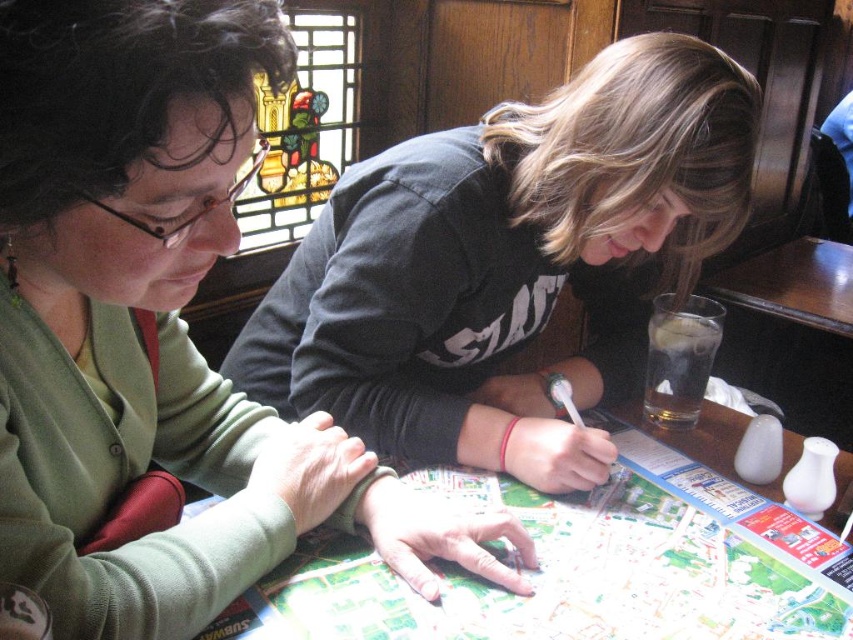
Can you confirm if green matte sweater at upper left is positioned to the right of white paper map at center?

Incorrect, green matte sweater at upper left is not on the right side of white paper map at center.

Is point (178, 616) positioned in front of point (573, 628)?

That is True.

The height and width of the screenshot is (640, 853). Identify the location of green matte sweater at upper left. (157, 333).

Is matte black shirt at center shorter than wooden table at right?

In fact, matte black shirt at center may be taller than wooden table at right.

Does point (663, 76) come behind point (834, 282)?

That is False.

At what (x,y) coordinates should I click in order to perform the action: click on matte black shirt at center. Please return your answer as a coordinate pair (x, y). This screenshot has height=640, width=853. Looking at the image, I should click on (508, 262).

Which is behind, point (253, 348) or point (650, 586)?

Positioned behind is point (253, 348).

Does matte black shirt at center have a smaller size compared to white paper map at center?

Actually, matte black shirt at center might be larger than white paper map at center.

What are the coordinates of `matte black shirt at center` in the screenshot? It's located at (508, 262).

Identify the location of matte black shirt at center. (508, 262).